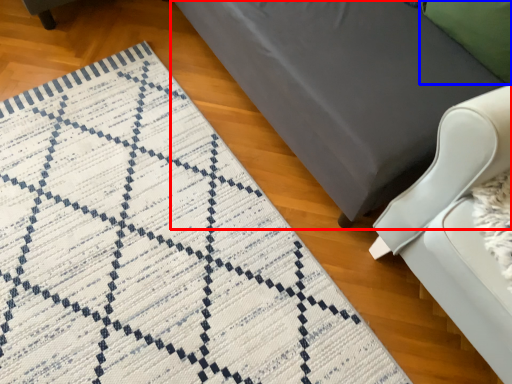
Question: Which of the following is the farthest to the observer, furniture (highlighted by a red box) or pillow (highlighted by a blue box)?

Choices:
 (A) furniture
 (B) pillow

Answer: (B)